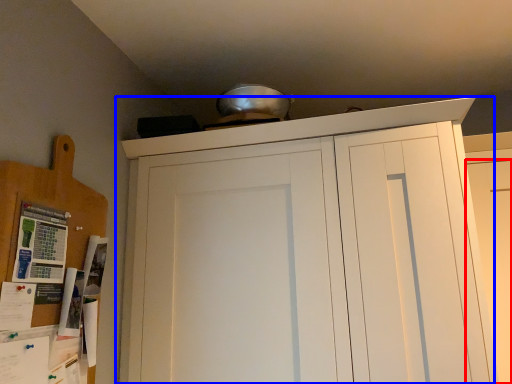
Question: Among these objects, which one is farthest to the camera, door (highlighted by a red box) or cupboard (highlighted by a blue box)?

Choices:
 (A) door
 (B) cupboard

Answer: (A)